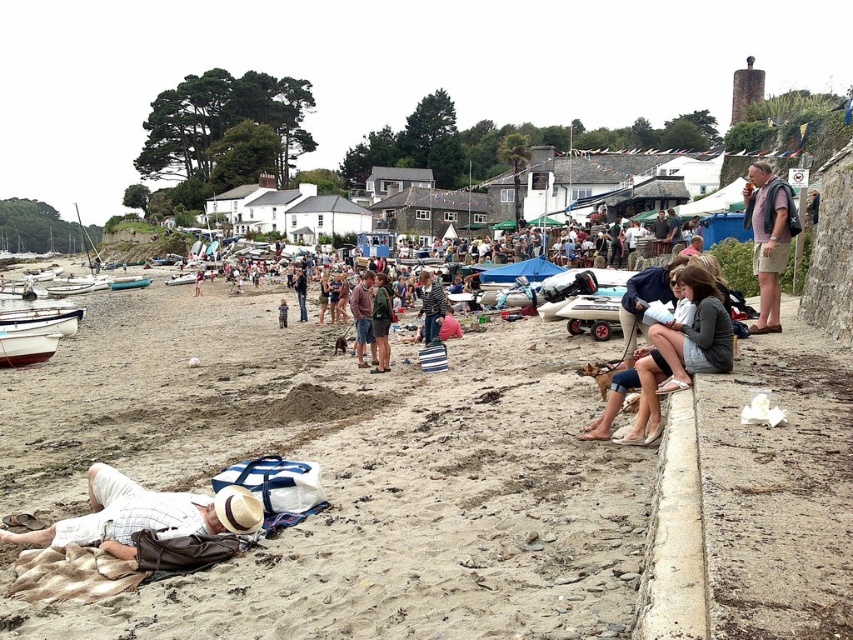
You are a photographer standing at the camera position. You want to capture a closeup of the pink fabric backpack at upper right. Can you reach it without moving from your current position?

The pink fabric backpack at upper right is 200.13 feet from camera, so you cannot reach it without moving from your current position to get a closeup.

You are standing at the origin point of the coordinate system in the image and want to find the matte gray sweater at center. Which direction should you move to locate it?

The matte gray sweater at center is located at coordinates point (612, 396), so you should move northeast to locate it.

You are a photographer trying to capture a shot of the denim shorts at center and the pink fabric backpack at upper right. To ensure both are in frame, should you adjust your camera to focus more to the left or the right?

The pink fabric backpack at upper right is to the right of denim shorts at center, so you should focus more to the right to include both in the frame.